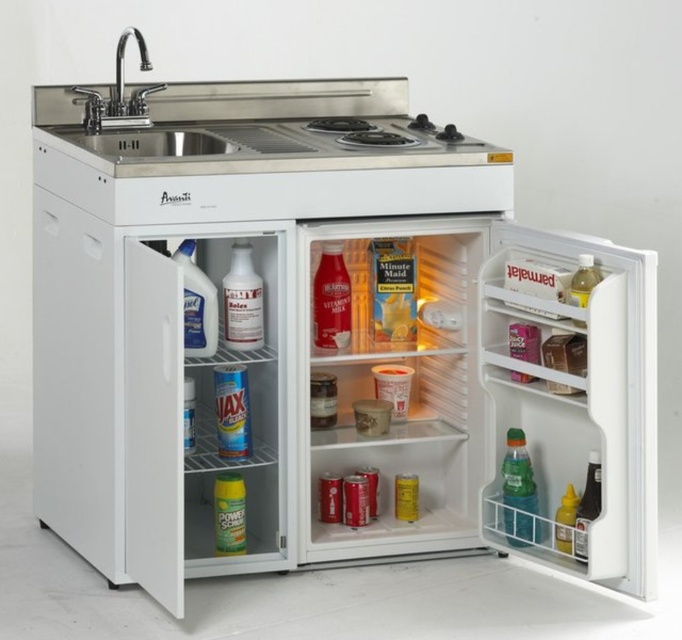
Can you confirm if silver metallic faucet at upper left is positioned above translucent plastic bottle at upper right?

Yes.

Between point (134, 28) and point (593, 268), which one is positioned behind?

Point (134, 28)

You are a GUI agent. You are given a task and a screenshot of the screen. Output one action in this format:
    pyautogui.click(x=<x>, y=<y>)
    Task: Click on the silver metallic faucet at upper left
    
    Given the screenshot: What is the action you would take?
    pyautogui.click(x=123, y=67)

Does green translucent bottle at right lie behind translucent plastic bottle at lower right?

Yes, green translucent bottle at right is behind translucent plastic bottle at lower right.

Does green translucent bottle at right have a lesser width compared to translucent plastic bottle at lower right?

No, green translucent bottle at right is not thinner than translucent plastic bottle at lower right.

Is point (504, 518) closer to viewer compared to point (576, 554)?

No, it is not.

You are a GUI agent. You are given a task and a screenshot of the screen. Output one action in this format:
    pyautogui.click(x=<x>, y=<y>)
    Task: Click on the green translucent bottle at right
    The height and width of the screenshot is (640, 682).
    Given the screenshot: What is the action you would take?
    pyautogui.click(x=518, y=492)

Based on the photo, does clear plastic bottle at left appear on the left side of translucent plastic bottle at upper right?

Correct, you'll find clear plastic bottle at left to the left of translucent plastic bottle at upper right.

Based on the photo, who is higher up, clear plastic bottle at left or translucent plastic bottle at upper right?

translucent plastic bottle at upper right is above.

Find the location of a particular element. This screenshot has width=682, height=640. clear plastic bottle at left is located at coordinates (196, 305).